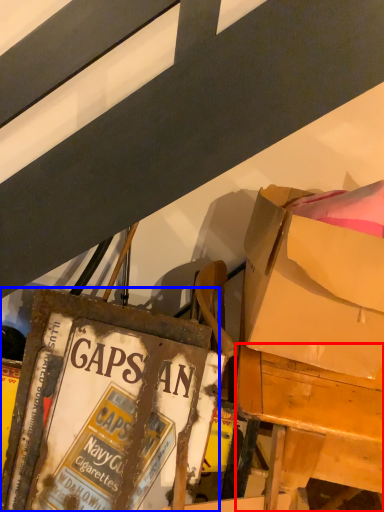
Question: Which object appears farthest to the camera in this image, desk (highlighted by a red box) or paperback book (highlighted by a blue box)?

Choices:
 (A) desk
 (B) paperback book

Answer: (B)